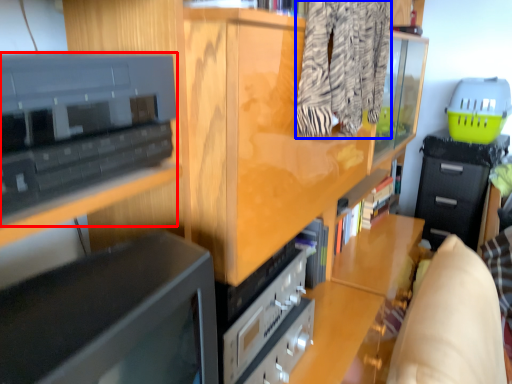
Question: Which of the following is the closest to the observer, cabinetry (highlighted by a red box) or clothing (highlighted by a blue box)?

Choices:
 (A) cabinetry
 (B) clothing

Answer: (A)